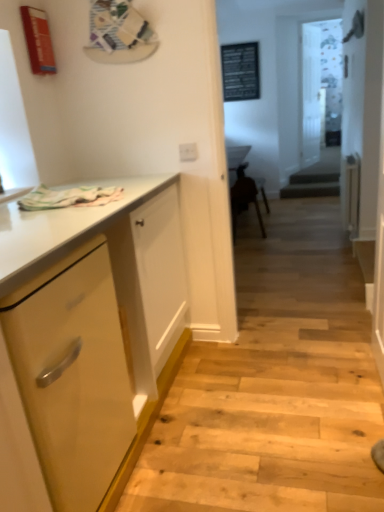
Question: Would you say white plastic electric outlet at upper center is a long distance from transparent glass door at center, the 1th glass door in the front-to-back sequence?

Choices:
 (A) no
 (B) yes

Answer: (B)

Question: Is white plastic electric outlet at upper center not within transparent glass door at center, the 1th glass door in the front-to-back sequence?

Choices:
 (A) yes
 (B) no

Answer: (A)

Question: Is white plastic electric outlet at upper center facing away from transparent glass door at center, which appears as the 2th glass door when viewed from the back?

Choices:
 (A) yes
 (B) no

Answer: (A)

Question: Can you confirm if white plastic electric outlet at upper center is thinner than transparent glass door at center, the 1th glass door in the front-to-back sequence?

Choices:
 (A) no
 (B) yes

Answer: (B)

Question: Is white plastic electric outlet at upper center next to transparent glass door at center, which appears as the 2th glass door when viewed from the back, and touching it?

Choices:
 (A) yes
 (B) no

Answer: (B)

Question: From a real-world perspective, is transparent glass door at center, which appears as the 2th glass door when viewed from the front, above or below transparent glass door at center, which appears as the 2th glass door when viewed from the back?

Choices:
 (A) below
 (B) above

Answer: (B)

Question: Considering their positions, is transparent glass door at center, which appears as the 2th glass door when viewed from the front, located in front of or behind transparent glass door at center, the 1th glass door in the front-to-back sequence?

Choices:
 (A) front
 (B) behind

Answer: (B)

Question: Considering the positions of transparent glass door at center, which is the first glass door in back-to-front order, and transparent glass door at center, the 1th glass door in the front-to-back sequence, in the image, is transparent glass door at center, which is the first glass door in back-to-front order, taller or shorter than transparent glass door at center, the 1th glass door in the front-to-back sequence,?

Choices:
 (A) tall
 (B) short

Answer: (A)

Question: Would you say transparent glass door at center, which appears as the 2th glass door when viewed from the front, is inside or outside transparent glass door at center, which appears as the 2th glass door when viewed from the back?

Choices:
 (A) outside
 (B) inside

Answer: (A)

Question: From a real-world perspective, relative to brown wooden chair at center, is transparent glass door at center, the 1th glass door in the front-to-back sequence, vertically above or below?

Choices:
 (A) below
 (B) above

Answer: (B)

Question: Would you say transparent glass door at center, which appears as the 2th glass door when viewed from the back, is to the left or to the right of brown wooden chair at center in the picture?

Choices:
 (A) right
 (B) left

Answer: (A)

Question: Choose the correct answer: Is transparent glass door at center, which appears as the 2th glass door when viewed from the back, inside brown wooden chair at center or outside it?

Choices:
 (A) inside
 (B) outside

Answer: (B)

Question: Relative to brown wooden chair at center, is transparent glass door at center, which appears as the 2th glass door when viewed from the back, in front or behind?

Choices:
 (A) behind
 (B) front

Answer: (A)

Question: Visually, is matte yellow cabinet at left positioned to the left or to the right of brown wooden chair at center?

Choices:
 (A) left
 (B) right

Answer: (A)

Question: Is matte yellow cabinet at left taller or shorter than brown wooden chair at center?

Choices:
 (A) short
 (B) tall

Answer: (B)